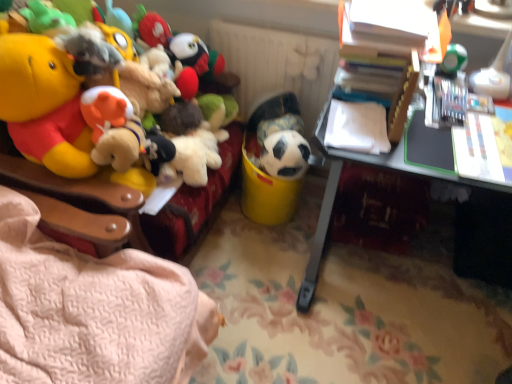
You are a GUI agent. You are given a task and a screenshot of the screen. Output one action in this format:
    pyautogui.click(x=<x>, y=<y>)
    Task: Click on the green matte die at upper right, arranged as the fourth toy when viewed from the left
    
    Given the screenshot: What is the action you would take?
    pos(453,60)

Measure the distance between white plastic desk at right and camera.

A distance of 1.09 meters exists between white plastic desk at right and camera.

The image size is (512, 384). What are the coordinates of `white matte radiator at upper center` in the screenshot? It's located at (277, 66).

What do you see at coordinates (67, 87) in the screenshot? The image size is (512, 384). I see `soft plush toys at left, acting as the first toy starting from the left` at bounding box center [67, 87].

The image size is (512, 384). In order to click on green matte die at upper right, arranged as the fourth toy when viewed from the left in this screenshot , I will do `click(453, 60)`.

In the scene shown: Relative to white plastic desk at right, is white matte radiator at upper center in front or behind?

In the image, white matte radiator at upper center appears behind white plastic desk at right.

Is white matte radiator at upper center facing away from white plastic desk at right?

white matte radiator at upper center is not turned away from white plastic desk at right.

How different are the orientations of white matte radiator at upper center and white plastic desk at right in degrees?

The angular difference between white matte radiator at upper center and white plastic desk at right is 0.262 degrees.

From a real-world perspective, which object stands above the other?

In real-world perspective, soft plush toys at left, acting as the first toy starting from the left, is above.

Is soft plush toys at left, positioned as the 4th toy in right-to-left order, facing away from white matte radiator at upper center?

That's not correct — soft plush toys at left, positioned as the 4th toy in right-to-left order, is not looking away from white matte radiator at upper center.

Locate an element on the screen. the 2nd toy below the white matte radiator at upper center (from the image's perspective) is located at coordinates (67, 87).

Measure the distance between soft plush toys at left, positioned as the 4th toy in right-to-left order, and white matte radiator at upper center.

soft plush toys at left, positioned as the 4th toy in right-to-left order, is 22.62 inches from white matte radiator at upper center.

From the image's perspective, is green matte die at upper right, arranged as the fourth toy when viewed from the left, beneath white matte radiator at upper center?

Yes, from the image's perspective, green matte die at upper right, arranged as the fourth toy when viewed from the left, is beneath white matte radiator at upper center.

Considering the sizes of green matte die at upper right, which is counted as the 1th toy, starting from the right, and white matte radiator at upper center in the image, is green matte die at upper right, which is counted as the 1th toy, starting from the right, bigger or smaller than white matte radiator at upper center?

In the image, green matte die at upper right, which is counted as the 1th toy, starting from the right, appears to be smaller than white matte radiator at upper center.

Which object is closer to the camera taking this photo, green matte die at upper right, which is counted as the 1th toy, starting from the right, or white matte radiator at upper center?

green matte die at upper right, which is counted as the 1th toy, starting from the right.

Does point (332, 71) come closer to viewer compared to point (265, 105)?

Yes.

I want to click on radiator behind the soccer ball at center, placed as the 3th toy when sorted from right to left, so click(277, 66).

Which object is further away from the camera, white matte radiator at upper center or soccer ball at center, the 2th toy in the left-to-right sequence?

white matte radiator at upper center is further from the camera.

Considering the sizes of objects white matte radiator at upper center and soccer ball at center, the 2th toy in the left-to-right sequence, in the image provided, who is thinner, white matte radiator at upper center or soccer ball at center, the 2th toy in the left-to-right sequence,?

With smaller width is white matte radiator at upper center.

Considering the sizes of objects white plastic desk at right and white matte radiator at upper center in the image provided, who is wider, white plastic desk at right or white matte radiator at upper center?

white plastic desk at right.

Is white plastic desk at right further to camera compared to white matte radiator at upper center?

No, the depth of white plastic desk at right is less than that of white matte radiator at upper center.

Which is closer to the camera, [406,95] or [303,119]?

The point [406,95] is closer to the camera.

At what (x,y) coordinates should I click in order to perform the action: click on desk that appears below the white matte radiator at upper center (from the image's perspective). Please return your answer as a coordinate pair (x, y). The height and width of the screenshot is (384, 512). Looking at the image, I should click on (335, 195).

Which object is wider, green matte die at upper right, which is counted as the 1th toy, starting from the right, or soccer ball at center, the 2th toy in the left-to-right sequence?

soccer ball at center, the 2th toy in the left-to-right sequence.

Based on the photo, can you confirm if green matte die at upper right, arranged as the fourth toy when viewed from the left, is shorter than soccer ball at center, the 2th toy in the left-to-right sequence?

Correct, green matte die at upper right, arranged as the fourth toy when viewed from the left, is not as tall as soccer ball at center, the 2th toy in the left-to-right sequence.

Is point (304, 141) farther from viewer compared to point (95, 139)?

Yes, point (304, 141) is behind point (95, 139).

Is black matte soccer ball at center, the 2th toy positioned from the right, taller or shorter than soft plush toys at left, acting as the first toy starting from the left?

Considering their sizes, black matte soccer ball at center, the 2th toy positioned from the right, has less height than soft plush toys at left, acting as the first toy starting from the left.

From the image's perspective, which toy is the 2nd one below the soft plush toys at left, positioned as the 4th toy in right-to-left order? Please provide its 2D coordinates.

[(285, 155)]

Looking at the image, does black matte soccer ball at center, marked as the third toy in a left-to-right arrangement, seem bigger or smaller compared to soft plush toys at left, acting as the first toy starting from the left?

Clearly, black matte soccer ball at center, marked as the third toy in a left-to-right arrangement, is smaller in size than soft plush toys at left, acting as the first toy starting from the left.

This screenshot has height=384, width=512. Identify the location of radiator above the white plastic desk at right (from a real-world perspective). (277, 66).

What are the coordinates of `radiator below the soft plush toys at left, acting as the first toy starting from the left (from a real-world perspective)` in the screenshot? It's located at (277, 66).

Which object lies nearer to the anchor point white matte radiator at upper center, black matte soccer ball at center, marked as the third toy in a left-to-right arrangement, or soft plush toys at left, positioned as the 4th toy in right-to-left order?

black matte soccer ball at center, marked as the third toy in a left-to-right arrangement, is positioned closer to the anchor white matte radiator at upper center.

In the scene shown: When comparing their distances from white matte radiator at upper center, does soft plush toys at left, positioned as the 4th toy in right-to-left order, or black matte soccer ball at center, marked as the third toy in a left-to-right arrangement, seem closer?

Based on the image, black matte soccer ball at center, marked as the third toy in a left-to-right arrangement, appears to be nearer to white matte radiator at upper center.

Considering their positions, is green matte die at upper right, arranged as the fourth toy when viewed from the left, positioned further to black matte soccer ball at center, the 2th toy positioned from the right, than white plastic desk at right?

Based on the image, green matte die at upper right, arranged as the fourth toy when viewed from the left, appears to be further to black matte soccer ball at center, the 2th toy positioned from the right.

Which object lies further to the anchor point black matte soccer ball at center, the 2th toy positioned from the right, soft plush toys at left, acting as the first toy starting from the left, or green matte die at upper right, arranged as the fourth toy when viewed from the left?

Among the two, soft plush toys at left, acting as the first toy starting from the left, is located further to black matte soccer ball at center, the 2th toy positioned from the right.

From the image, which object appears to be nearer to white matte radiator at upper center, white plastic desk at right or soccer ball at center, placed as the 3th toy when sorted from right to left?

soccer ball at center, placed as the 3th toy when sorted from right to left.

Which object lies further to the anchor point soft plush toys at left, acting as the first toy starting from the left, white plastic desk at right or green matte die at upper right, which is counted as the 1th toy, starting from the right?

Based on the image, green matte die at upper right, which is counted as the 1th toy, starting from the right, appears to be further to soft plush toys at left, acting as the first toy starting from the left.

Estimate the real-world distances between objects in this image. Which object is further from soccer ball at center, the 2th toy in the left-to-right sequence, black matte soccer ball at center, marked as the third toy in a left-to-right arrangement, or soft plush toys at left, positioned as the 4th toy in right-to-left order?

soft plush toys at left, positioned as the 4th toy in right-to-left order, is positioned further to the anchor soccer ball at center, the 2th toy in the left-to-right sequence.

From the image, which object appears to be nearer to green matte die at upper right, which is counted as the 1th toy, starting from the right, white plastic desk at right or soccer ball at center, the 2th toy in the left-to-right sequence?

white plastic desk at right.

The width and height of the screenshot is (512, 384). In order to click on toy between soccer ball at center, placed as the 3th toy when sorted from right to left, and green matte die at upper right, arranged as the fourth toy when viewed from the left, in the horizontal direction in this screenshot , I will do `click(285, 155)`.

What are the coordinates of `toy located between white plastic desk at right and black matte soccer ball at center, the 2th toy positioned from the right, in the depth direction` in the screenshot? It's located at (453, 60).

At what (x,y) coordinates should I click in order to perform the action: click on radiator situated between soft plush toys at left, acting as the first toy starting from the left, and white plastic desk at right from left to right. Please return your answer as a coordinate pair (x, y). Image resolution: width=512 pixels, height=384 pixels. Looking at the image, I should click on (277, 66).

Locate an element on the screen. The height and width of the screenshot is (384, 512). desk situated between soft plush toys at left, positioned as the 4th toy in right-to-left order, and green matte die at upper right, arranged as the fourth toy when viewed from the left, from left to right is located at coordinates (335, 195).